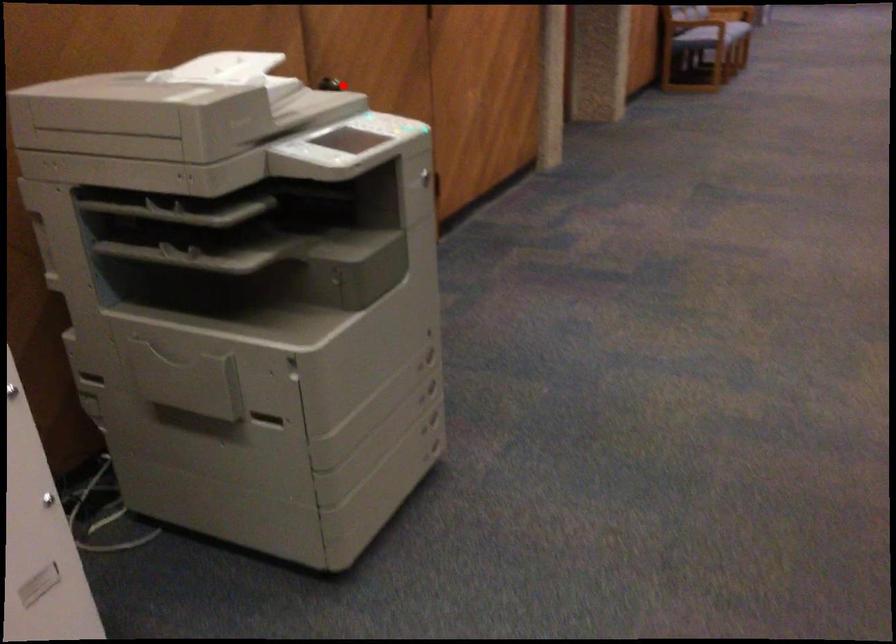
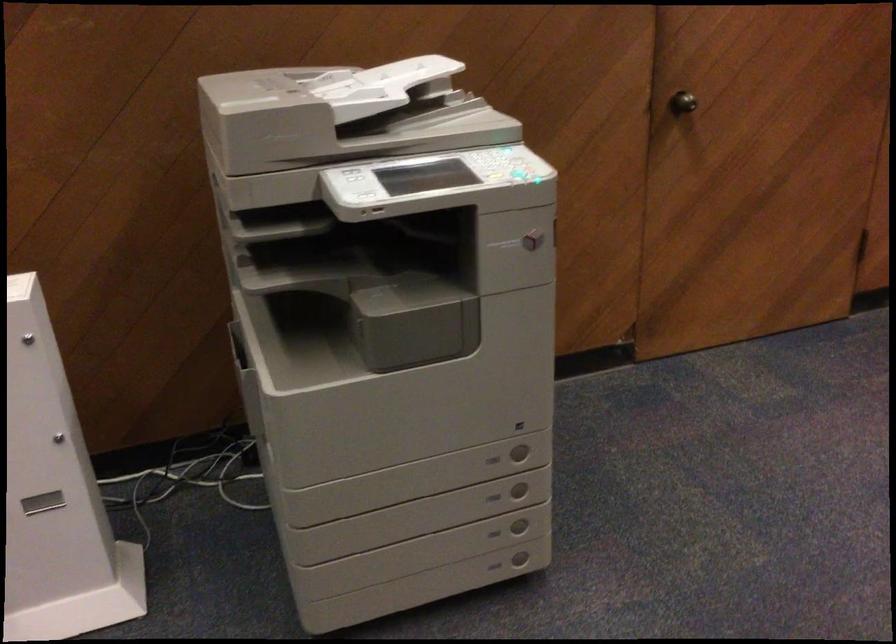
Question: I am providing you with two images of the same scene from different viewpoints. In image1, a red point is highlighted. Considering the same 3D point in image2, which of the following is correct?

Choices:
 (A) It is closer
 (B) It is farther

Answer: (A)